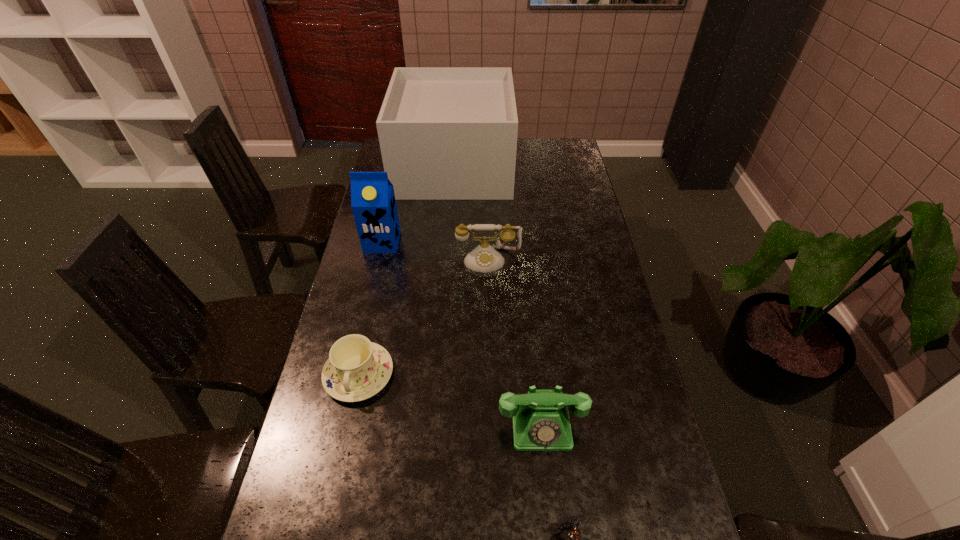
You are a GUI agent. You are given a task and a screenshot of the screen. Output one action in this format:
    pyautogui.click(x=<x>, y=<y>)
    Task: Click on the farthest object
    
    Given the screenshot: What is the action you would take?
    pyautogui.click(x=446, y=133)

The width and height of the screenshot is (960, 540). Find the location of `carton`. carton is located at coordinates (373, 203).

Locate an element on the screen. the farthest telephone is located at coordinates (484, 258).

The width and height of the screenshot is (960, 540). In order to click on the second nearest telephone in this screenshot , I will do `click(541, 422)`.

This screenshot has height=540, width=960. What are the coordinates of `chinaware` in the screenshot? It's located at (357, 369).

You are a GUI agent. You are given a task and a screenshot of the screen. Output one action in this format:
    pyautogui.click(x=<x>, y=<y>)
    Task: Click on the vacant space located on the side of the box with the window
    The height and width of the screenshot is (540, 960).
    Given the screenshot: What is the action you would take?
    pyautogui.click(x=549, y=166)

Identify the location of vacant area situated 0.370m with the cap open on the carton. (360, 339).

Where is `vacant region located 0.210m on the dial of the farthest telephone`? Image resolution: width=960 pixels, height=540 pixels. vacant region located 0.210m on the dial of the farthest telephone is located at coordinates (490, 322).

Locate an element on the screen. The height and width of the screenshot is (540, 960). vacant space located 0.080m on the dial of the second farthest telephone is located at coordinates (548, 487).

Identify the location of vacant space located 0.230m on the handle side of the chinaware. (331, 500).